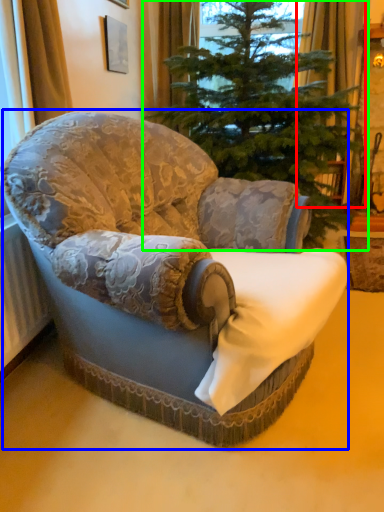
Question: Based on their relative distances, which object is nearer to curtain (highlighted by a red box)? Choose from chair (highlighted by a blue box) and christmas tree (highlighted by a green box).

Choices:
 (A) chair
 (B) christmas tree

Answer: (B)